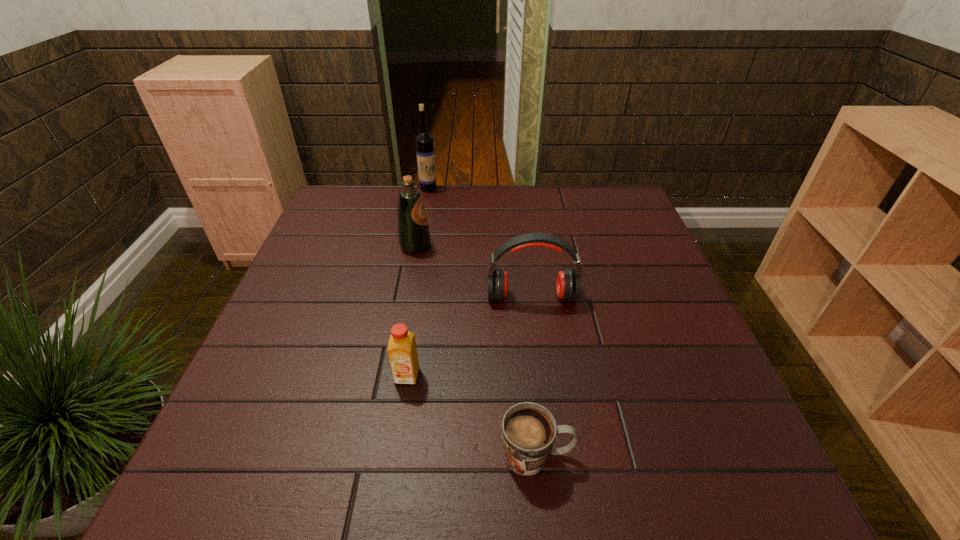
Locate an element on the screen. vacant point located between the tallest object and the shortest object is located at coordinates (483, 322).

You are a GUI agent. You are given a task and a screenshot of the screen. Output one action in this format:
    pyautogui.click(x=<x>, y=<y>)
    Task: Click on the free space between the earphone and the mug
    
    Given the screenshot: What is the action you would take?
    pyautogui.click(x=534, y=376)

Locate which object ranks in proximity to the olive oil. Please provide its 2D coordinates. Your answer should be formatted as a tuple, i.e. [(x, y)], where the tuple contains the x and y coordinates of a point satisfying the conditions above.

[(568, 284)]

This screenshot has height=540, width=960. Find the location of `object that is the closest to the mug`. object that is the closest to the mug is located at coordinates (402, 351).

Identify the location of vacant space that satisfies the following two spatial constraints: 1. on the ear cups of the earphone; 2. on the side of the mug with the handle. (552, 455).

Locate an element on the screen. Image resolution: width=960 pixels, height=540 pixels. free space that satisfies the following two spatial constraints: 1. on the label of the tallest object; 2. on the front-facing side of the olive oil is located at coordinates pos(419,246).